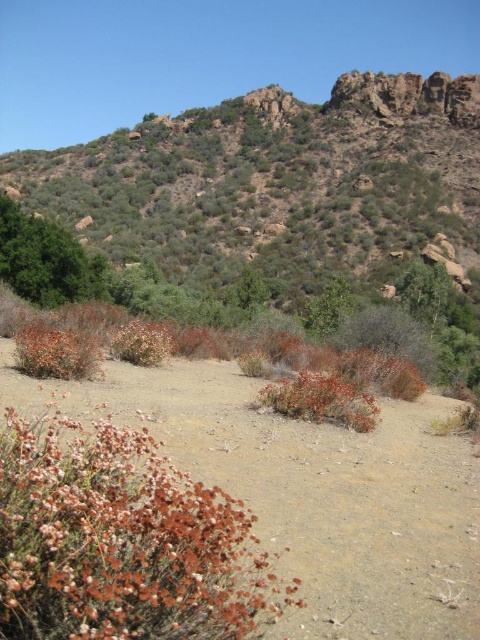
You are a botanist examining the dried brown flowers at lower left and the dried grass at center in this desert landscape. Which of these two plants has a larger size?

The dried brown flowers at lower left are larger than the dried grass at center.

You are a botanist examining the landscape. You notice two plants in the foreground. The first is dried brown flowers at lower left, and the second is dried grass at center. Which of these plants is positioned higher relative to the other?

The dried brown flowers at lower left is positioned above the dried grass at center.